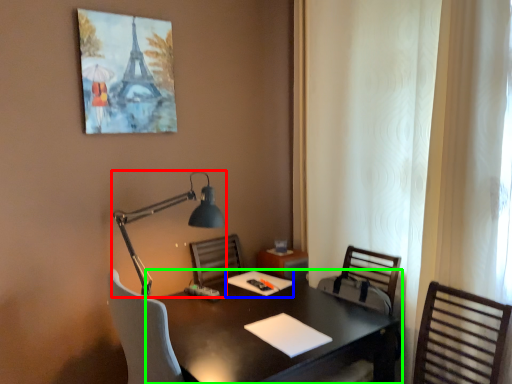
Question: Considering the real-world distances, which object is farthest from lamp (highlighted by a red box)? notepad (highlighted by a blue box) or desk (highlighted by a green box)?

Choices:
 (A) notepad
 (B) desk

Answer: (B)